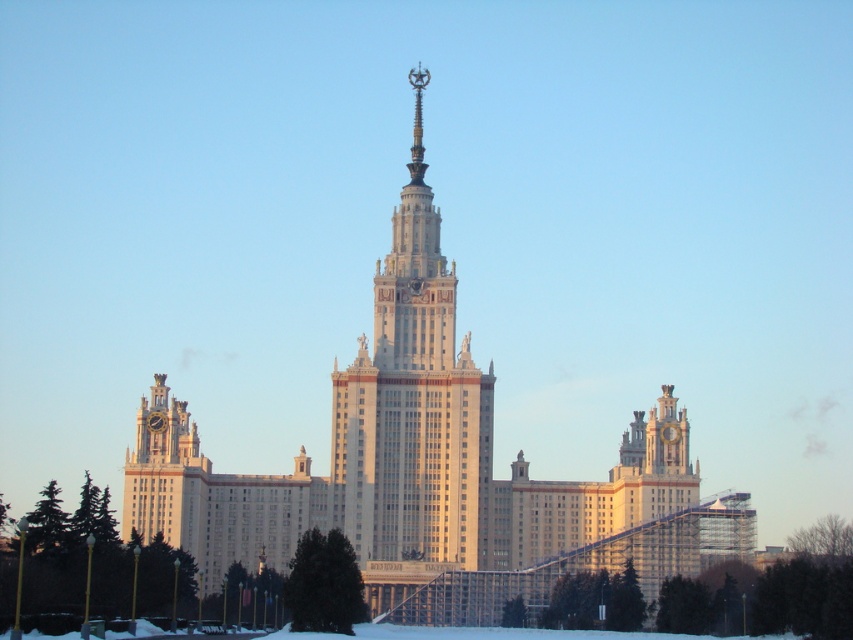
Question: Among these points, which one is nearest to the camera?

Choices:
 (A) (374, 512)
 (B) (454, 586)

Answer: (A)

Question: Can you confirm if white stone building at center is positioned above white marble tower at center?

Choices:
 (A) yes
 (B) no

Answer: (B)

Question: Is white stone building at center below white marble tower at center?

Choices:
 (A) no
 (B) yes

Answer: (B)

Question: Which object appears closest to the camera in this image?

Choices:
 (A) white marble tower at center
 (B) white stone building at center

Answer: (A)

Question: Does white stone building at center appear on the left side of white marble tower at center?

Choices:
 (A) no
 (B) yes

Answer: (A)